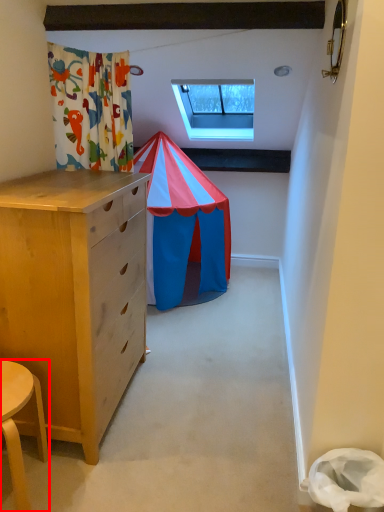
Question: From the image's perspective, where is table (annotated by the red box) located in relation to window in the image?

Choices:
 (A) above
 (B) below

Answer: (B)